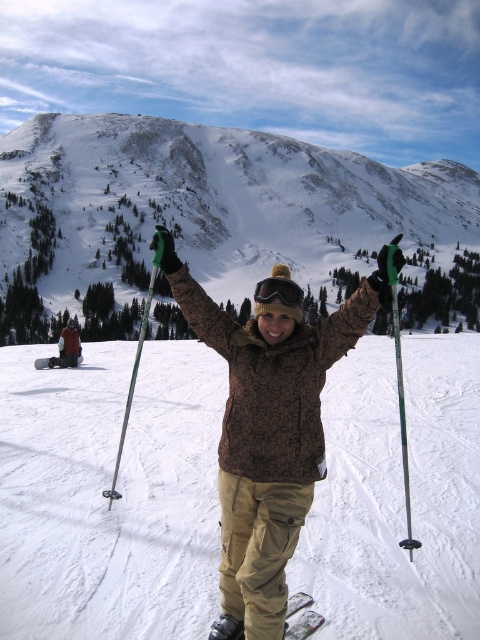
Question: Can you confirm if snowy rocky mountain at upper center is thinner than green plastic ski pole at center?

Choices:
 (A) no
 (B) yes

Answer: (A)

Question: Which point is farther from the camera taking this photo?

Choices:
 (A) (75, 333)
 (B) (333, 557)
 (C) (133, 364)

Answer: (A)

Question: Does white snow ski slope at center appear under metallic silver ski pole at center?

Choices:
 (A) yes
 (B) no

Answer: (A)

Question: Which of the following is the farthest from the observer?

Choices:
 (A) green plastic ski pole at center
 (B) brown fuzzy jacket at center
 (C) snowy rocky mountain at upper center
 (D) white matte ski at lower center

Answer: (C)

Question: Is snowy rocky mountain at upper center in front of white matte ski at lower center?

Choices:
 (A) no
 (B) yes

Answer: (A)

Question: Which point is closer to the camera?

Choices:
 (A) matte black jacket at center
 (B) brown fuzzy jacket at center
 (C) metallic silver ski pole at center

Answer: (B)